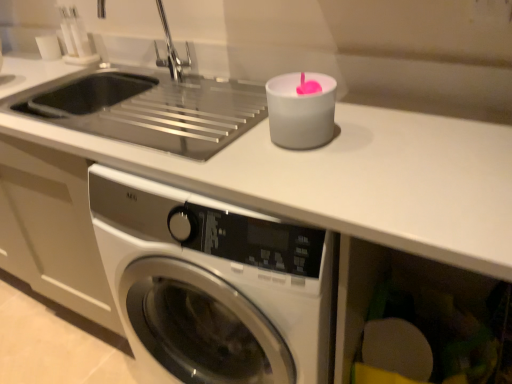
Question: Which is correct: silver metallic faucet at upper left is inside white matte counter top at upper center, or outside of it?

Choices:
 (A) inside
 (B) outside

Answer: (B)

Question: Considering the positions of silver metallic faucet at upper left and white matte counter top at upper center in the image, is silver metallic faucet at upper left taller or shorter than white matte counter top at upper center?

Choices:
 (A) short
 (B) tall

Answer: (A)

Question: Which of these objects is positioned farthest from the silver metallic faucet at upper left?

Choices:
 (A) white matte candle at upper right
 (B) white matte counter top at upper center
 (C) matte plastic sponge at lower right

Answer: (C)

Question: Estimate the real-world distances between objects in this image. Which object is farther from the silver metallic faucet at upper left?

Choices:
 (A) matte plastic sponge at lower right
 (B) white matte candle at upper right
 (C) white matte counter top at upper center

Answer: (A)